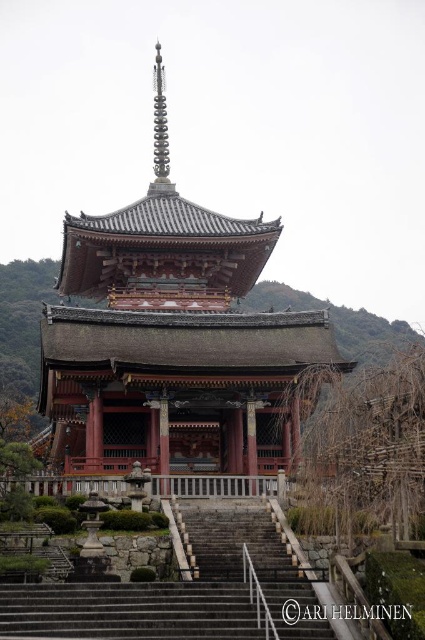
Question: From the image, what is the correct spatial relationship of shiny red pagoda at center in relation to gray stone stairs at lower center?

Choices:
 (A) left
 (B) right

Answer: (A)

Question: Can you confirm if shiny red pagoda at center is positioned above dark gray stone stairs at center?

Choices:
 (A) no
 (B) yes

Answer: (B)

Question: Is shiny red pagoda at center to the right of dark gray stone stairs at center from the viewer's perspective?

Choices:
 (A) yes
 (B) no

Answer: (B)

Question: Which of the following is the farthest from the observer?

Choices:
 (A) (237, 593)
 (B) (163, 584)

Answer: (B)

Question: Which point is closer to the camera?

Choices:
 (A) (130, 218)
 (B) (319, 628)

Answer: (B)

Question: Which object is positioned farthest from the dark gray stone stairs at center?

Choices:
 (A) shiny red pagoda at center
 (B) gray stone stairs at lower center

Answer: (A)